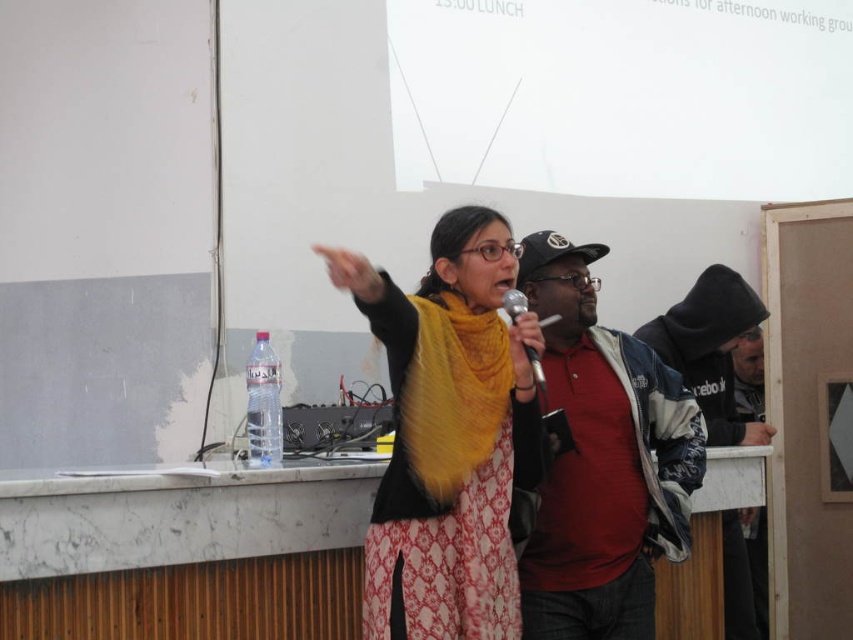
You are a photographer standing in the classroom. You need to take a photo of the matte black jacket at center from a distance that allows the camera to focus clearly. The camera you are using has a minimum focusing distance of 8 feet. Can you take the photo without moving closer than 8.44 feet?

The matte black jacket at center and camera are 8.44 feet apart. Since the camera requires a minimum focusing distance of 8 feet, the distance of 8.44 feet is sufficient, so yes, you can take the photo without moving closer than 8.44 feet.

You are a photographer trying to capture the speaker at the podium. You notice the yellow wool scarf at center and the matte black jacket at center. Which of these items would require you to focus on a closer plane to get sharp details?

The yellow wool scarf at center is thinner than the matte black jacket at center, so focusing on the yellow wool scarf at center would require a closer plane for sharp details because it is nearer to the camera.

You are an event planner organizing a photoshoot in this classroom scene. You need to decide which item, the yellow wool scarf at center or the matte black jacket at center, would be easier to see from the back row of the classroom. Which one would you choose and why?

The yellow wool scarf at center has a smaller size compared to the matte black jacket at center. However, the bright yellow color of the scarf makes it more visually distinct from a distance, so it would be easier to see from the back row.